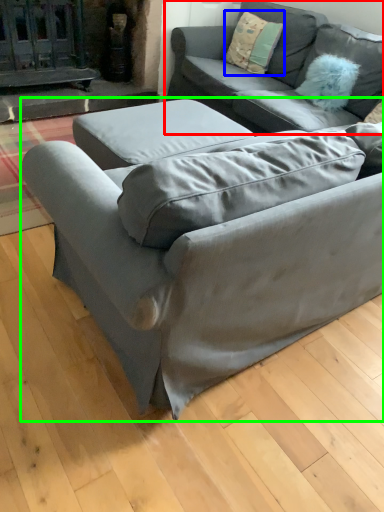
Question: Which object is positioned closest to studio couch (highlighted by a red box)? Select from pillow (highlighted by a blue box) and studio couch (highlighted by a green box).

Choices:
 (A) pillow
 (B) studio couch

Answer: (A)